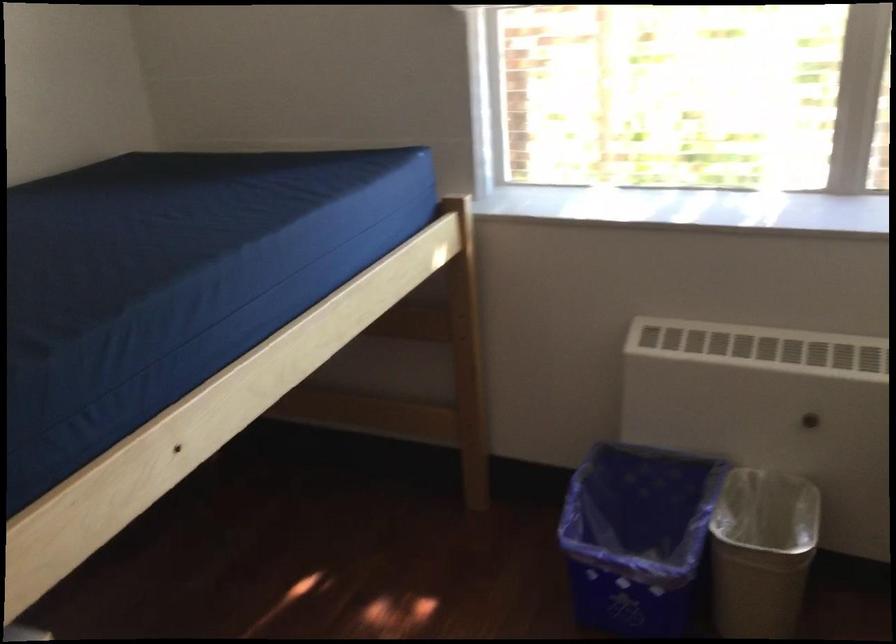
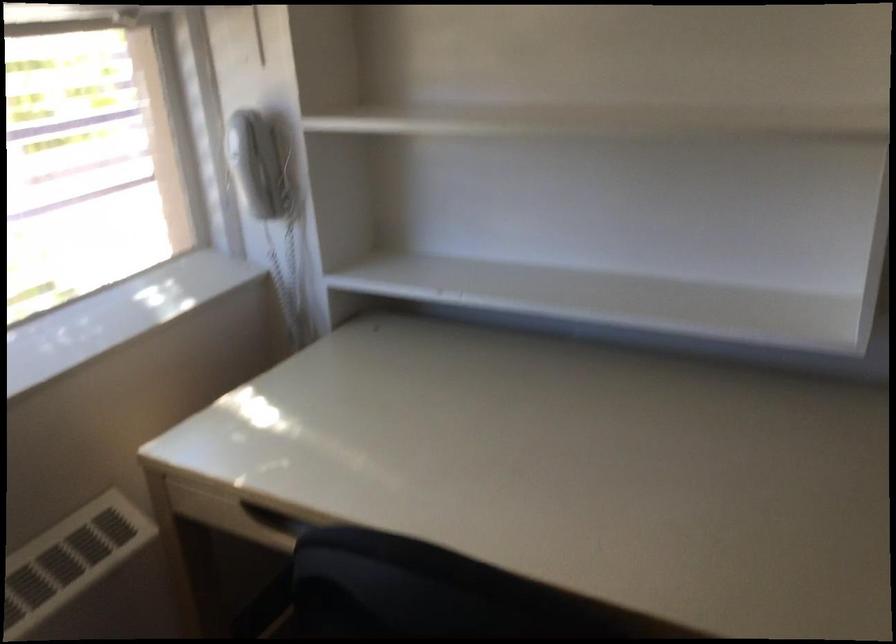
How did the camera likely rotate?

The rotation direction of the camera is right-down.